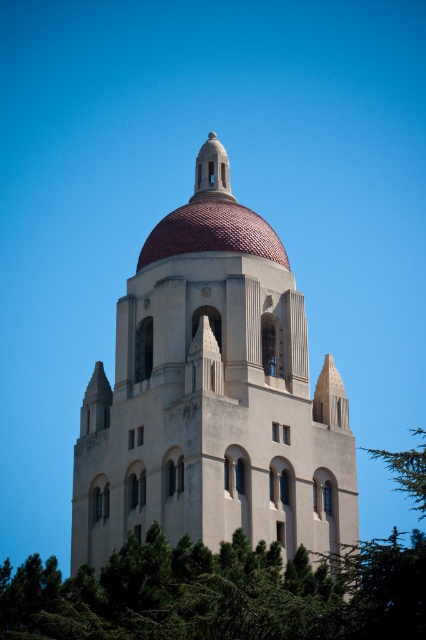
Question: Which of the following is the farthest from the observer?

Choices:
 (A) (267, 323)
 (B) (37, 580)
 (C) (408, 474)
 (D) (150, 253)

Answer: (D)

Question: Among these objects, which one is nearest to the camera?

Choices:
 (A) green textured tree at right
 (B) beige stone church at center
 (C) green leafy tree at lower center

Answer: (C)

Question: Can you confirm if green leafy tree at lower center is positioned below terracotta tiled dome at center?

Choices:
 (A) yes
 (B) no

Answer: (A)

Question: Based on their relative distances, which object is nearer to the beige stone church at center?

Choices:
 (A) green textured tree at right
 (B) terracotta tiled dome at center

Answer: (B)

Question: In this image, where is beige stone church at center located relative to green leafy tree at lower center?

Choices:
 (A) right
 (B) left

Answer: (A)

Question: Is beige stone church at center bigger than green textured tree at right?

Choices:
 (A) no
 (B) yes

Answer: (A)